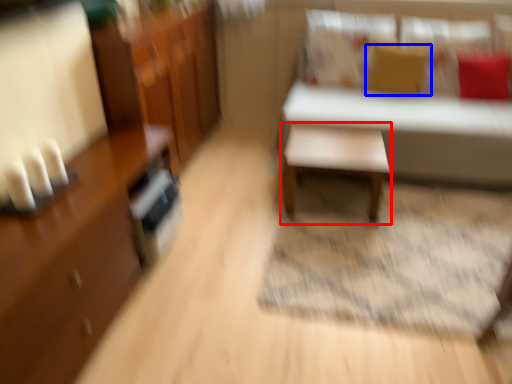
Question: Which of the following is the farthest to the observer, table (highlighted by a red box) or pillow (highlighted by a blue box)?

Choices:
 (A) table
 (B) pillow

Answer: (B)